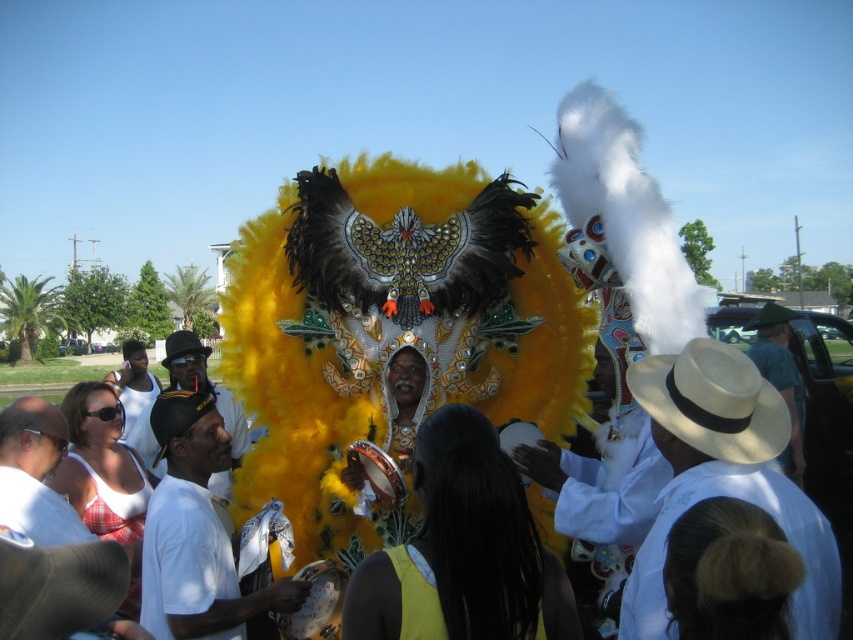
Question: Considering the relative positions of white cotton hat at center and black felt cowboy hat at center in the image provided, where is white cotton hat at center located with respect to black felt cowboy hat at center?

Choices:
 (A) above
 (B) below

Answer: (B)

Question: From the image, what is the correct spatial relationship of white cotton shirt at center in relation to yellow matte dress at center?

Choices:
 (A) above
 (B) below

Answer: (A)

Question: Is the position of white cotton shirt at lower left less distant than that of white cotton hat at center?

Choices:
 (A) yes
 (B) no

Answer: (A)

Question: Which is nearer to the white cotton shirt at lower left?

Choices:
 (A) yellow matte dress at center
 (B) light brown straw hat at lower right
 (C) white cotton hat at center
 (D) white straw hat at lower right

Answer: (C)

Question: Which of these objects is positioned closest to the yellow matte dress at center?

Choices:
 (A) white cotton hat at center
 (B) white cotton shirt at lower left

Answer: (B)

Question: Which of these objects is positioned farthest from the white cotton shirt at lower left?

Choices:
 (A) white straw hat at center
 (B) brown straw cowboy hat at center

Answer: (B)